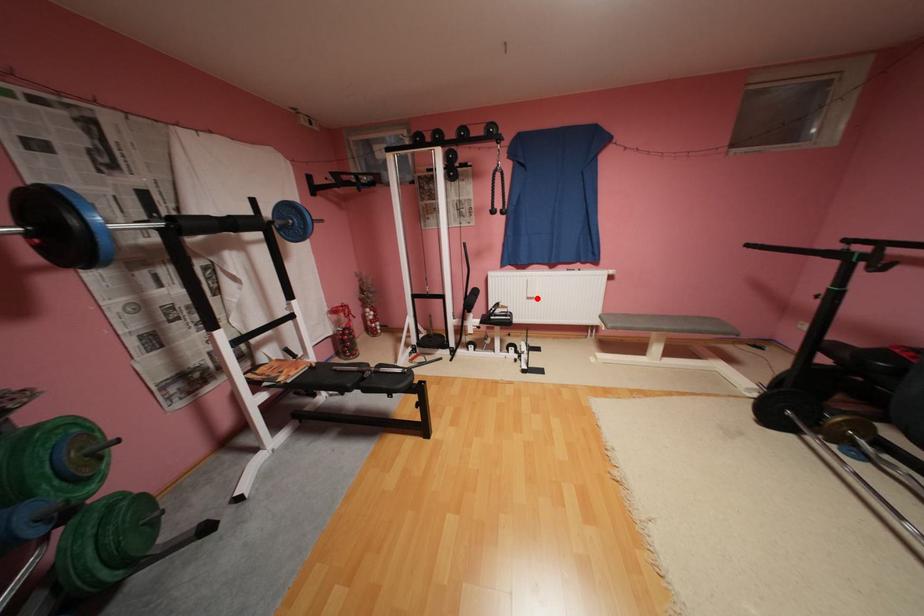
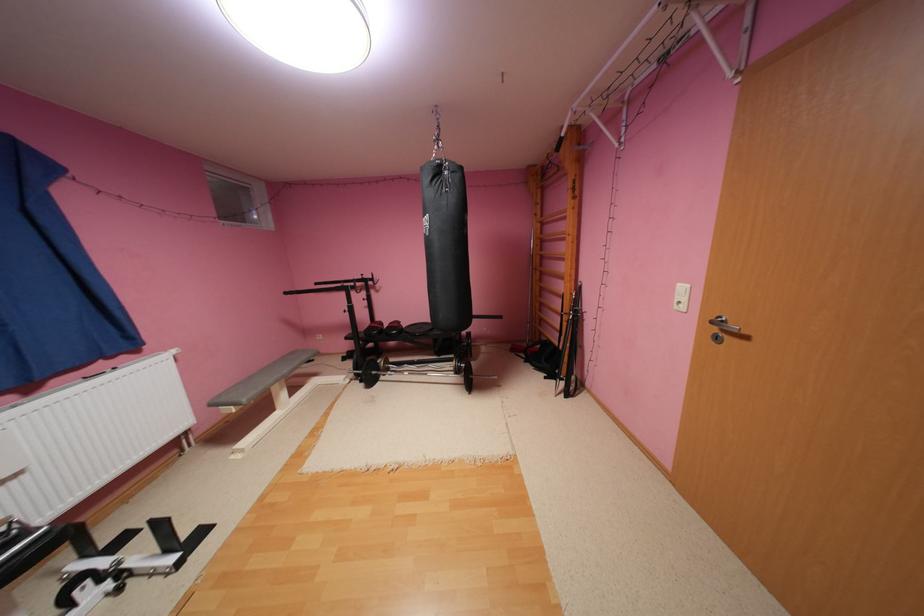
Question: I am providing you with two images of the same scene from different viewpoints. A red point is marked on the first image. At the location where the point appears in image 1, is it still visible in image 2?

Choices:
 (A) Yes
 (B) No

Answer: (A)